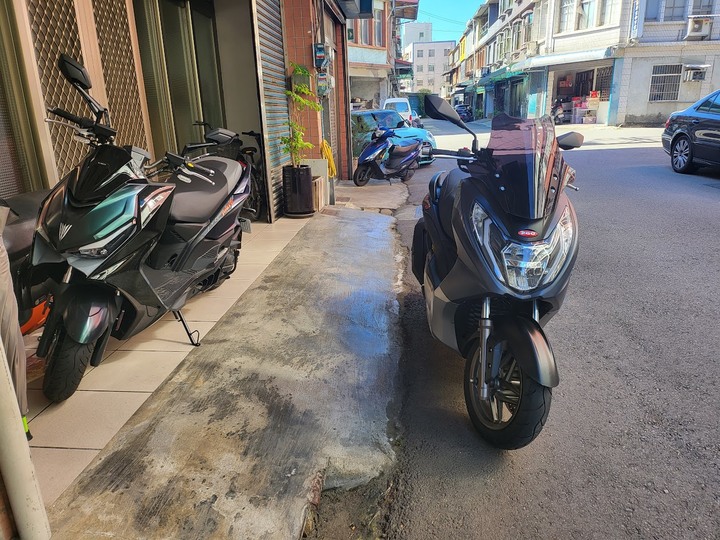
This screenshot has width=720, height=540. Find the location of `tile`. tile is located at coordinates pos(124,382).